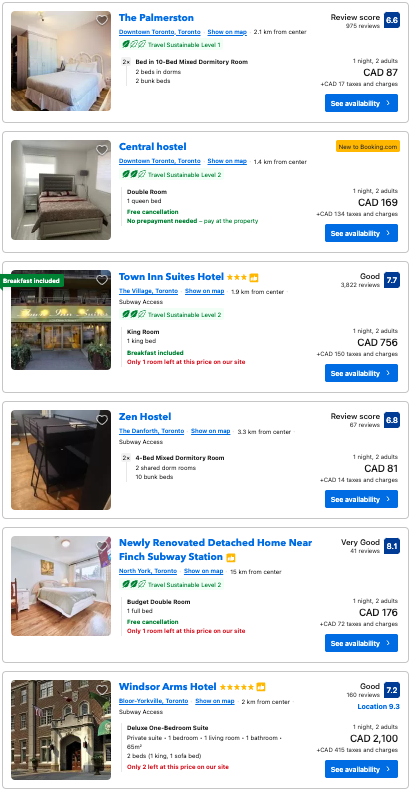
Image resolution: width=413 pixels, height=792 pixels. I want to click on bunk bed, so click(55, 451).